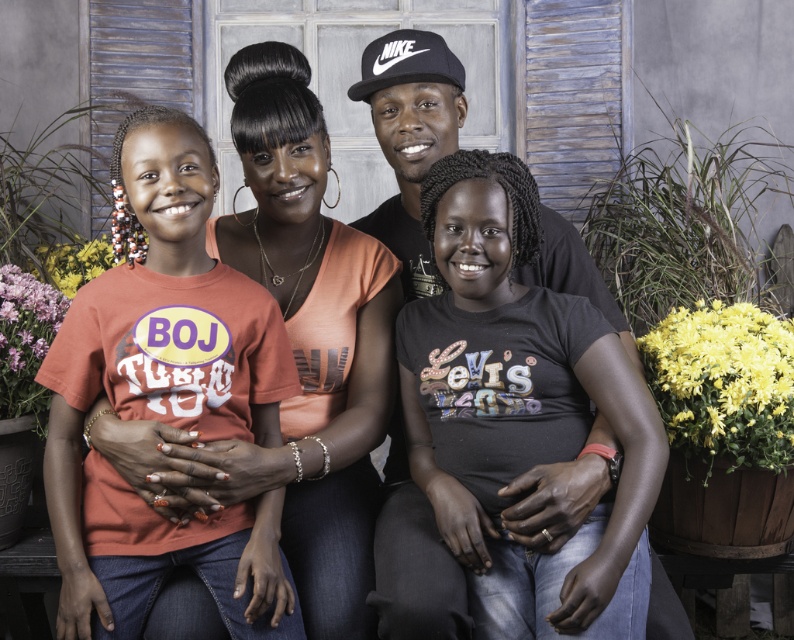
Question: Which object appears closest to the camera in this image?

Choices:
 (A) matte black t-shirt at center
 (B) matte orange t-shirt at left

Answer: (A)

Question: Is matte black t-shirt at center smaller than matte orange t-shirt at left?

Choices:
 (A) no
 (B) yes

Answer: (A)

Question: Can you confirm if matte black t-shirt at center is positioned to the right of matte orange t-shirt at left?

Choices:
 (A) yes
 (B) no

Answer: (A)

Question: Can you confirm if matte black t-shirt at center is positioned to the right of matte orange t-shirt at left?

Choices:
 (A) no
 (B) yes

Answer: (B)

Question: Which object appears farthest from the camera in this image?

Choices:
 (A) matte black t-shirt at center
 (B) matte orange t-shirt at left

Answer: (B)